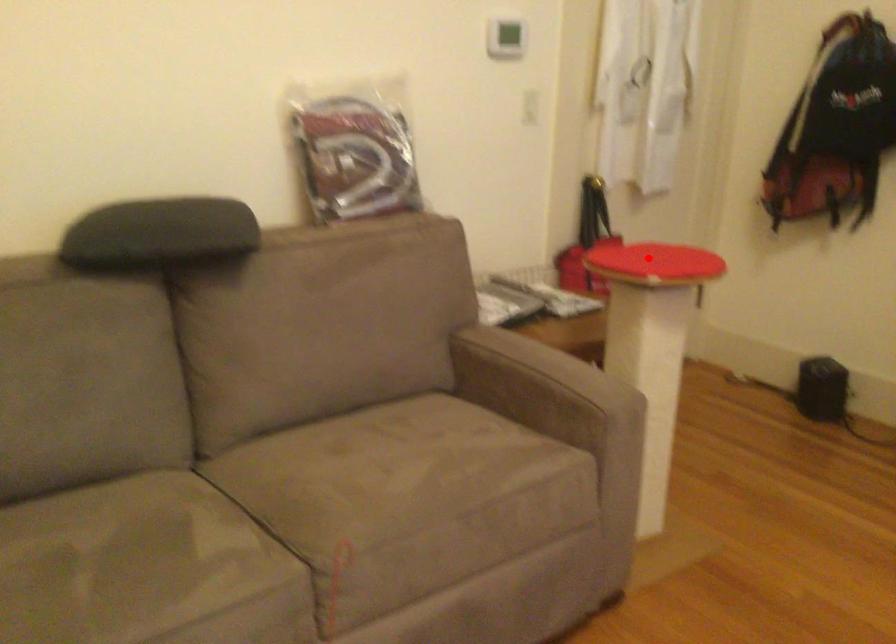
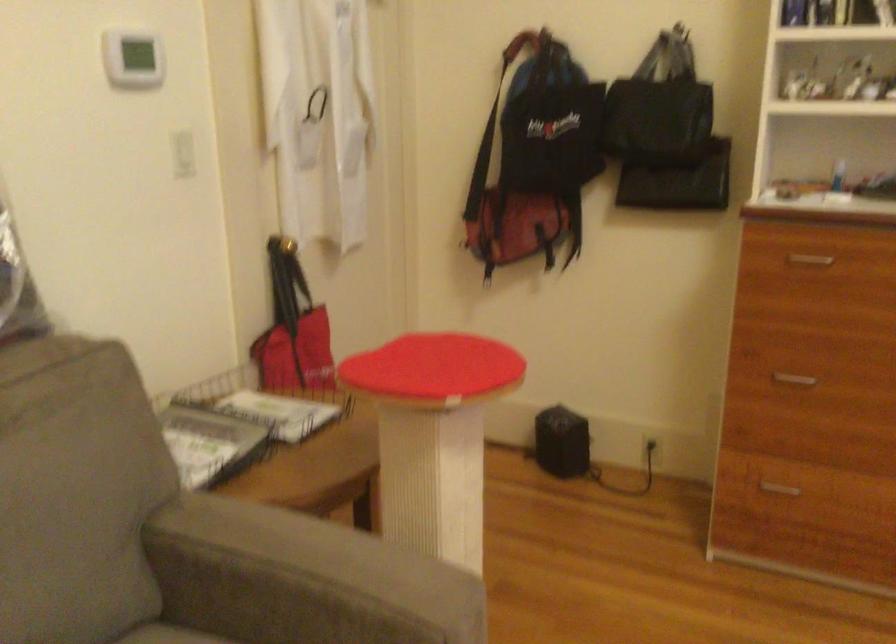
In the second image, find the point that corresponds to the highlighted location in the first image.

(434, 366)